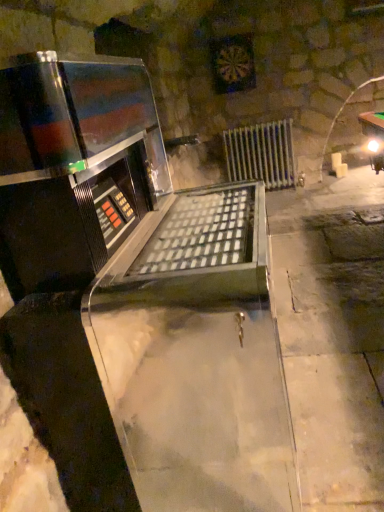
Question: Can you confirm if silver metallic radiator at center is bigger than shiny metallic wine cellar at center?

Choices:
 (A) no
 (B) yes

Answer: (A)

Question: Can you confirm if silver metallic radiator at center is positioned to the right of shiny metallic wine cellar at center?

Choices:
 (A) yes
 (B) no

Answer: (A)

Question: Is silver metallic radiator at center located outside shiny metallic wine cellar at center?

Choices:
 (A) no
 (B) yes

Answer: (B)

Question: Is silver metallic radiator at center positioned before shiny metallic wine cellar at center?

Choices:
 (A) no
 (B) yes

Answer: (A)

Question: Could you tell me if silver metallic radiator at center is turned towards shiny metallic wine cellar at center?

Choices:
 (A) yes
 (B) no

Answer: (A)

Question: Is shiny metallic wine cellar at center at the back of silver metallic radiator at center?

Choices:
 (A) yes
 (B) no

Answer: (B)

Question: Can you see shiny metallic wine cellar at center touching silver metallic radiator at center?

Choices:
 (A) yes
 (B) no

Answer: (B)

Question: Is shiny metallic wine cellar at center further to camera compared to silver metallic radiator at center?

Choices:
 (A) no
 (B) yes

Answer: (A)

Question: Considering the relative sizes of shiny metallic wine cellar at center and silver metallic radiator at center in the image provided, is shiny metallic wine cellar at center bigger than silver metallic radiator at center?

Choices:
 (A) yes
 (B) no

Answer: (A)

Question: From a real-world perspective, is shiny metallic wine cellar at center positioned over silver metallic radiator at center based on gravity?

Choices:
 (A) no
 (B) yes

Answer: (B)

Question: Does shiny metallic wine cellar at center have a lesser width compared to silver metallic radiator at center?

Choices:
 (A) no
 (B) yes

Answer: (A)

Question: From a real-world perspective, does shiny metallic wine cellar at center sit lower than silver metallic radiator at center?

Choices:
 (A) yes
 (B) no

Answer: (B)

Question: Is point (264, 156) closer or farther from the camera than point (54, 354)?

Choices:
 (A) farther
 (B) closer

Answer: (A)